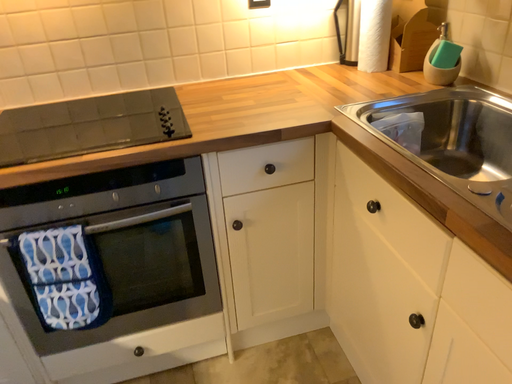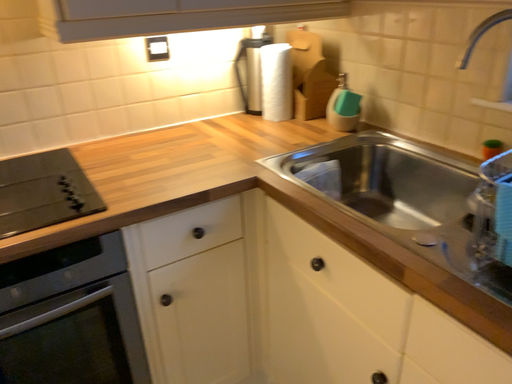
Question: How did the camera likely rotate when shooting the video?

Choices:
 (A) rotated right
 (B) rotated left

Answer: (A)